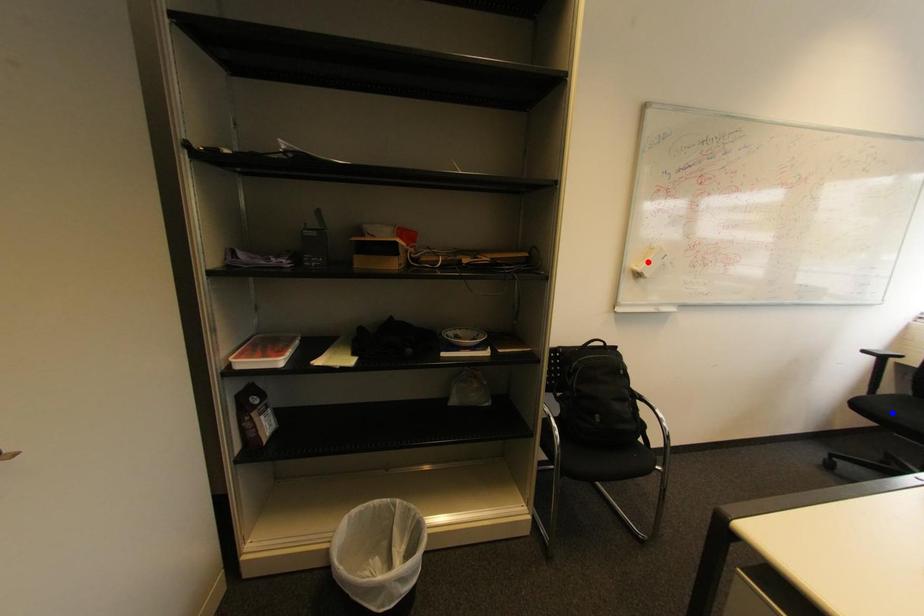
Question: Two points are marked on the image. Which point is closer to the camera?

Choices:
 (A) Blue point is closer.
 (B) Red point is closer.

Answer: (A)